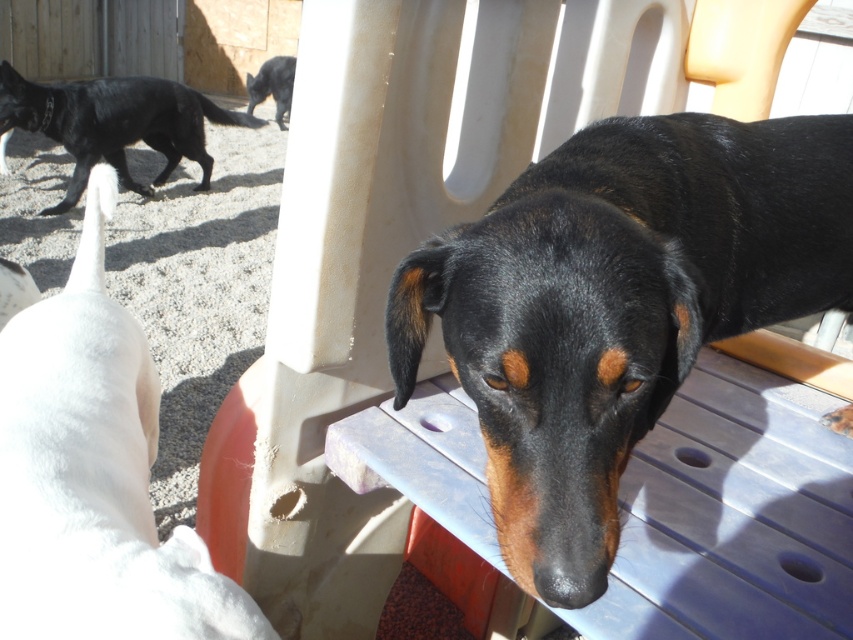
Find the location of a particular element. This screenshot has width=853, height=640. black glossy dog at upper left is located at coordinates [114, 124].

In the scene shown: Who is more forward, (86, 179) or (267, 72)?

Point (86, 179)

This screenshot has width=853, height=640. What are the coordinates of `black glossy dog at upper left` in the screenshot? It's located at (114, 124).

Is black shiny dog at center to the left of shiny black cat at upper left from the viewer's perspective?

Incorrect, black shiny dog at center is not on the left side of shiny black cat at upper left.

Does point (608, 524) lie in front of point (250, 104)?

That is True.

The image size is (853, 640). Identify the location of black shiny dog at center. (618, 305).

Is point (62, 358) more distant than point (287, 68)?

No, (62, 358) is in front of (287, 68).

Which is in front, point (193, 531) or point (258, 74)?

Point (193, 531) is more forward.

Is point (91, 595) positioned behind point (264, 81)?

That is False.

Identify the location of white fur dog at lower left. (94, 474).